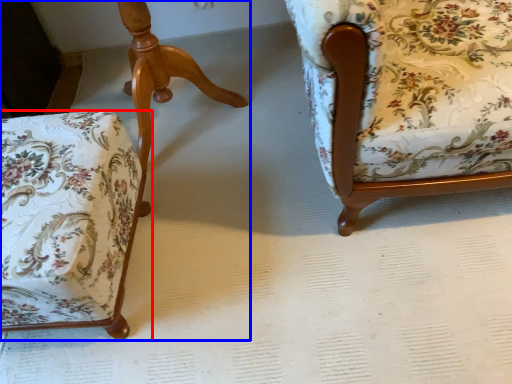
Question: Which object appears farthest to the camera in this image, chair (highlighted by a red box) or chair (highlighted by a blue box)?

Choices:
 (A) chair
 (B) chair

Answer: (B)